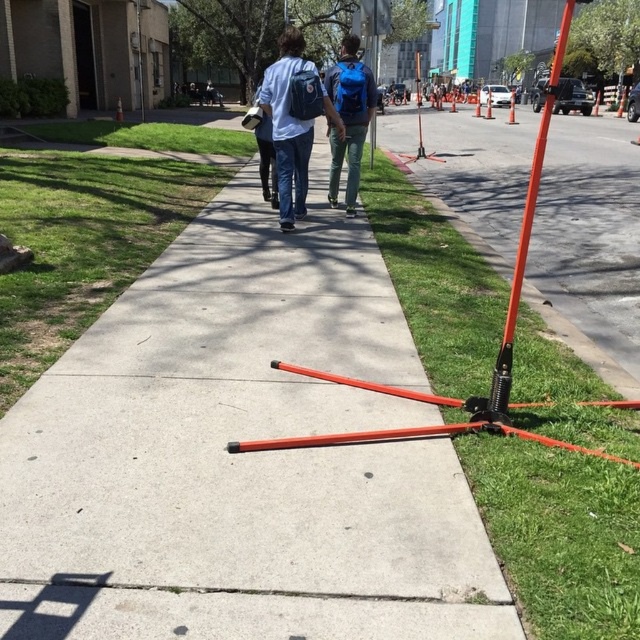
Does green grass at lower left have a smaller size compared to orange metallic pole at right?

Yes.

Image resolution: width=640 pixels, height=640 pixels. What do you see at coordinates (81, 243) in the screenshot?
I see `green grass at lower left` at bounding box center [81, 243].

Where is `green grass at lower left`? green grass at lower left is located at coordinates (81, 243).

Can you confirm if orange metal tripod at center is shorter than matte blue backpack at center?

Yes, orange metal tripod at center is shorter than matte blue backpack at center.

Who is more forward, (x=282, y=433) or (x=348, y=211)?

Point (x=282, y=433) is more forward.

Locate an element on the screen. The image size is (640, 640). orange metal tripod at center is located at coordinates (241, 456).

Who is more forward, (534, 490) or (365, 72)?

Point (534, 490) is more forward.

Is orange grass at lower right to the right of blue backpack at center from the viewer's perspective?

Indeed, orange grass at lower right is positioned on the right side of blue backpack at center.

From the picture: Who is more distant from viewer, (397, 211) or (348, 209)?

Positioned behind is point (397, 211).

Where is `orange grass at lower right`? This screenshot has width=640, height=640. orange grass at lower right is located at coordinates (561, 534).